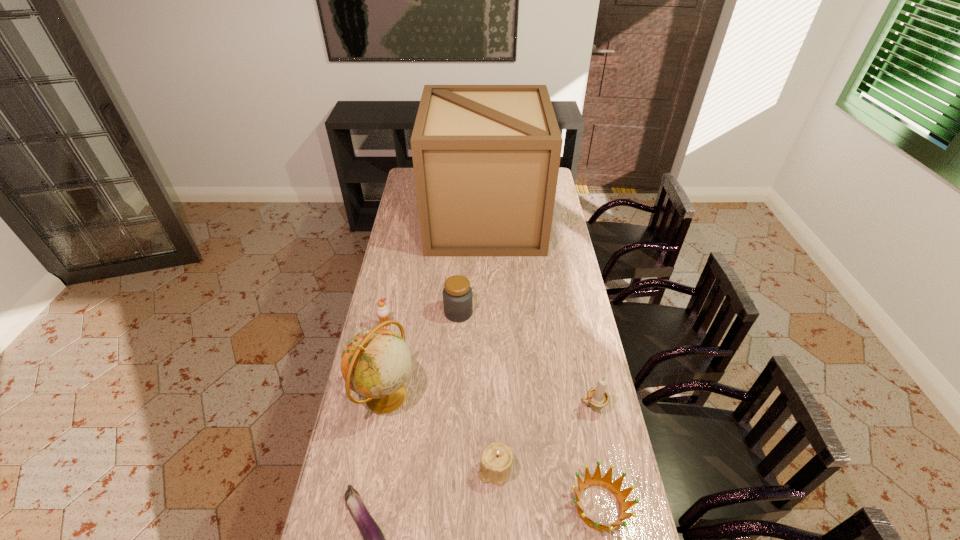
Find the location of a particular element. This screenshot has height=540, width=960. vacant space located on the reinforced sides of the farthest object is located at coordinates (403, 220).

You are a GUI agent. You are given a task and a screenshot of the screen. Output one action in this format:
    pyautogui.click(x=<x>, y=<y>)
    Task: Click on the free space located 0.070m on the back of the globe
    Image resolution: width=960 pixels, height=540 pixels.
    Given the screenshot: What is the action you would take?
    pyautogui.click(x=394, y=350)

You are a GUI agent. You are given a task and a screenshot of the screen. Output one action in this format:
    pyautogui.click(x=<x>, y=<y>)
    Task: Click on the vacant space located 0.200m on the surface of the jar near the warning symbol
    
    Given the screenshot: What is the action you would take?
    pyautogui.click(x=522, y=313)

Identify the location of free location located on the handle side of the right candle_holder. Image resolution: width=960 pixels, height=540 pixels. (489, 408).

Locate an element on the screen. The image size is (960, 540). blank space located on the handle side of the right candle_holder is located at coordinates (528, 408).

Find the location of a particular element. The image size is (960, 540). free space located on the handle side of the right candle_holder is located at coordinates (549, 408).

This screenshot has width=960, height=540. I want to click on vacant space located 0.210m at the front with a straw on the icecream, so coord(375,374).

Identify the location of vacant space located on the left of the left candle_holder. Image resolution: width=960 pixels, height=540 pixels. (x=448, y=469).

This screenshot has width=960, height=540. I want to click on box that is at the left edge, so click(x=486, y=158).

The image size is (960, 540). In order to click on globe located in the left edge section of the desktop in this screenshot , I will do `click(375, 363)`.